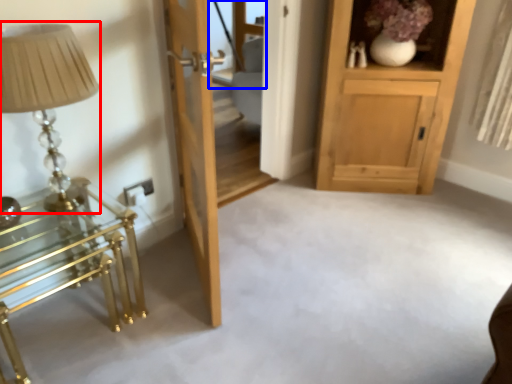
Question: Which of the following is the farthest to the observer, table lamp (highlighted by a red box) or glass door (highlighted by a blue box)?

Choices:
 (A) table lamp
 (B) glass door

Answer: (B)